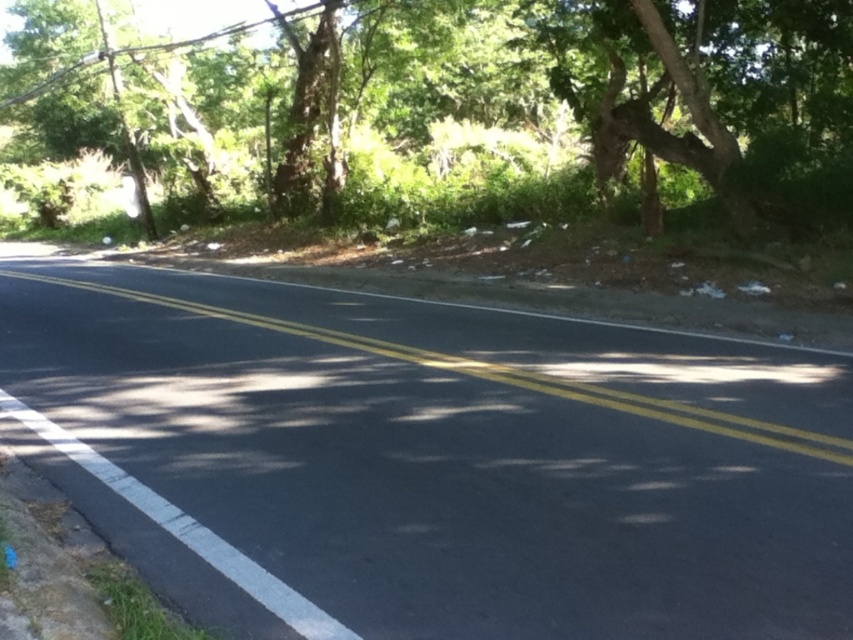
You are a delivery driver navigating a rural road. Your GPS shows a point at coordinates (450, 458). Based on the scene description, where is this point located?

The point at coordinates (450, 458) is located on the black asphalt road at center, as indicated by the objects description.

You are standing at the origin point in the image and want to walk to the black asphalt road at center. In which direction should you move based on its 2D coordinates?

The black asphalt road at center is located at coordinates point (450, 458), so you should move towards the right and slightly downward direction from your current position at the origin.

You are driving a car and need to stay within the lanes on the black asphalt road at center. Which side of the green leafy tree at upper center should you keep the car on to stay in the correct lane?

The black asphalt road at center is positioned on the right side of the green leafy tree at upper center, so you should keep the car on the right side of the green leafy tree at upper center to stay in the correct lane.